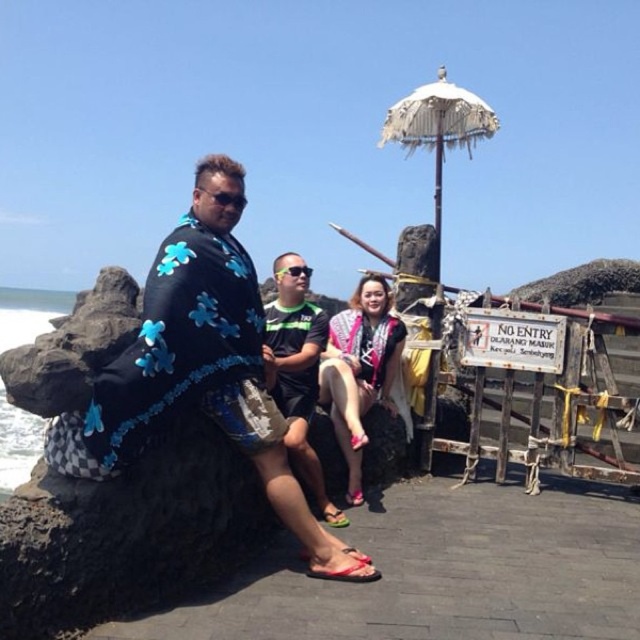
Does black fabric with blue flowers at center lie in front of black fabric shirt at center?

Yes, black fabric with blue flowers at center is in front of black fabric shirt at center.

Does point (180, 257) lie in front of point (298, 454)?

Yes, it is.

Locate an element on the screen. black fabric with blue flowers at center is located at coordinates (209, 360).

Locate an element on the screen. Image resolution: width=640 pixels, height=640 pixels. patterned fabric dress at center is located at coordinates (358, 369).

Between patterned fabric dress at center and black fabric shirt at center, which one has more height?

Standing taller between the two is black fabric shirt at center.

Identify the location of patterned fabric dress at center. The width and height of the screenshot is (640, 640). (358, 369).

Who is more forward, (86,442) or (396,330)?

Point (86,442) is in front.

Between black fabric with blue flowers at center and patterned fabric dress at center, which one appears on the left side from the viewer's perspective?

From the viewer's perspective, black fabric with blue flowers at center appears more on the left side.

Find the location of a particular element. black fabric with blue flowers at center is located at coordinates (209, 360).